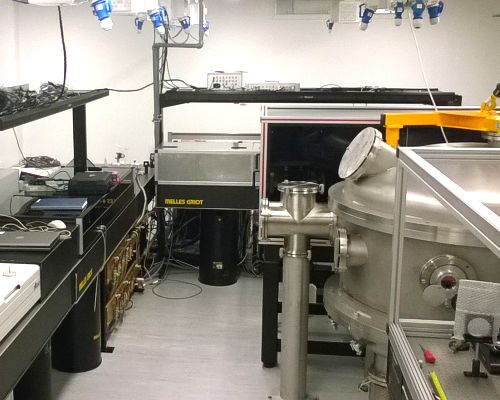
At what (x,y) coordinates should I click in order to perform the action: click on black stands. Please return your answer as a coordinate pair (x, y). This screenshot has width=500, height=400. Looking at the image, I should click on (215, 234), (65, 348).